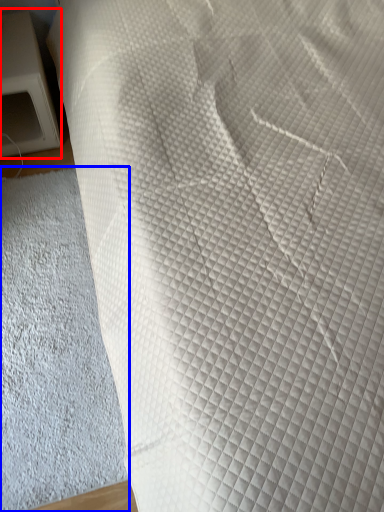
Question: Which object is further to the camera taking this photo, furniture (highlighted by a red box) or sheet (highlighted by a blue box)?

Choices:
 (A) furniture
 (B) sheet

Answer: (A)